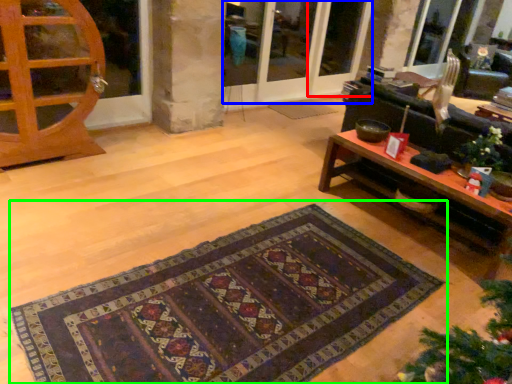
Question: Based on their relative distances, which object is farther from screen door (highlighted by a red box)? Choose from screen door (highlighted by a blue box) and mat (highlighted by a green box).

Choices:
 (A) screen door
 (B) mat

Answer: (B)